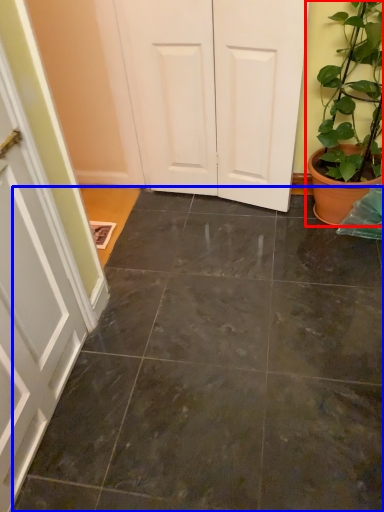
Question: Which point is further to the camera, houseplant (highlighted by a red box) or concrete (highlighted by a blue box)?

Choices:
 (A) houseplant
 (B) concrete

Answer: (A)